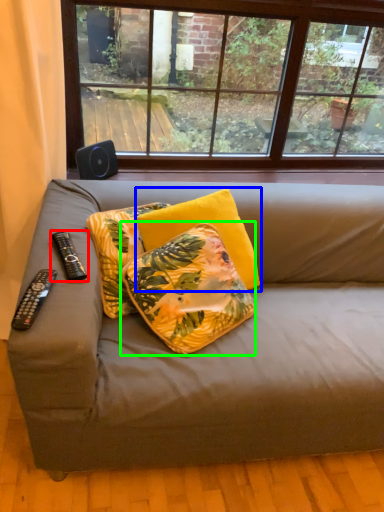
Question: Considering the real-world distances, which object is farthest from remote control (highlighted by a red box)? pillow (highlighted by a blue box) or pillow (highlighted by a green box)?

Choices:
 (A) pillow
 (B) pillow

Answer: (A)